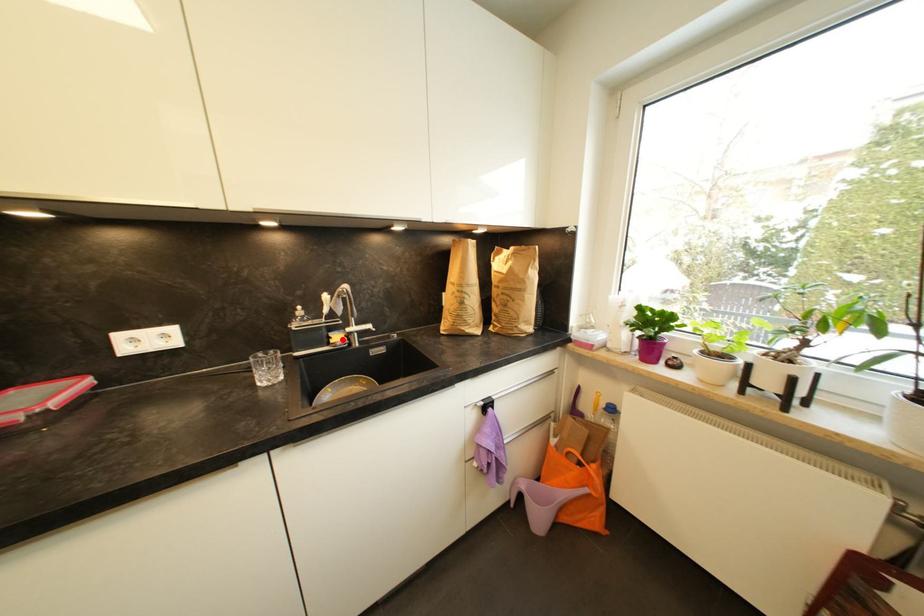
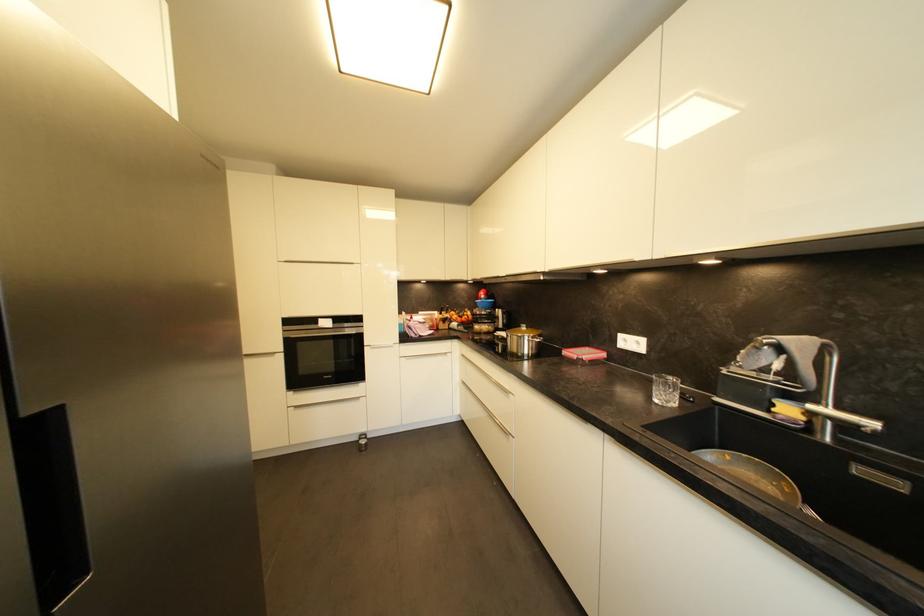
Find the pixel in the second image that matches the highlighted location in the first image.

(793, 411)